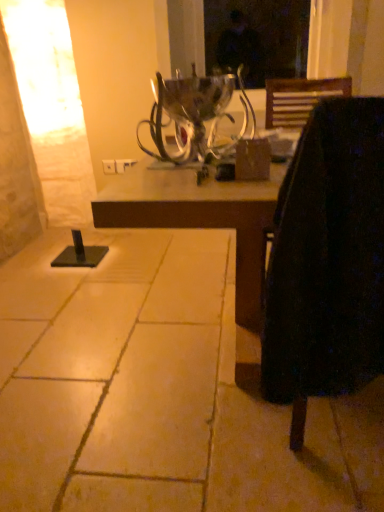
Where is `vacant space underneath matte brown table at center (from a real-world perspective)`? This screenshot has height=512, width=384. vacant space underneath matte brown table at center (from a real-world perspective) is located at coordinates (203, 330).